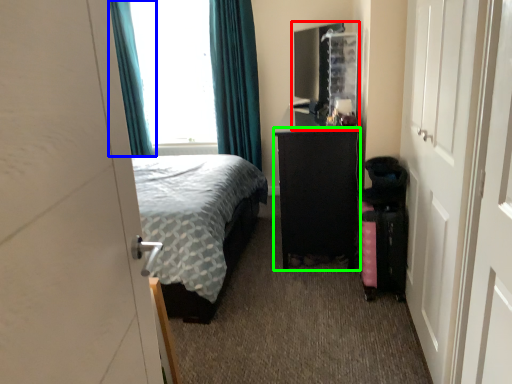
Question: Which object is the farthest from file cabinet (highlighted by a red box)? Choose among these: curtain (highlighted by a blue box) or furniture (highlighted by a green box).

Choices:
 (A) curtain
 (B) furniture

Answer: (A)